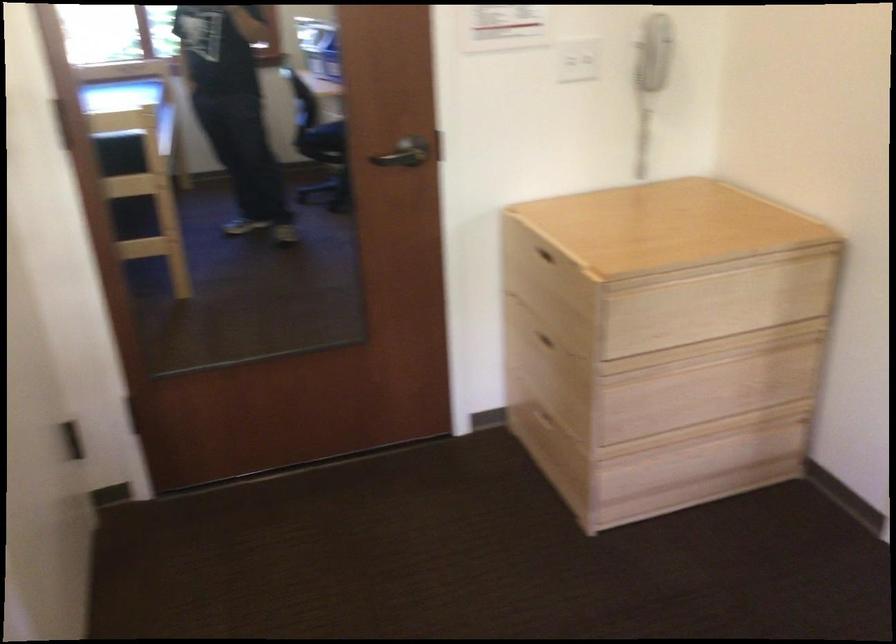
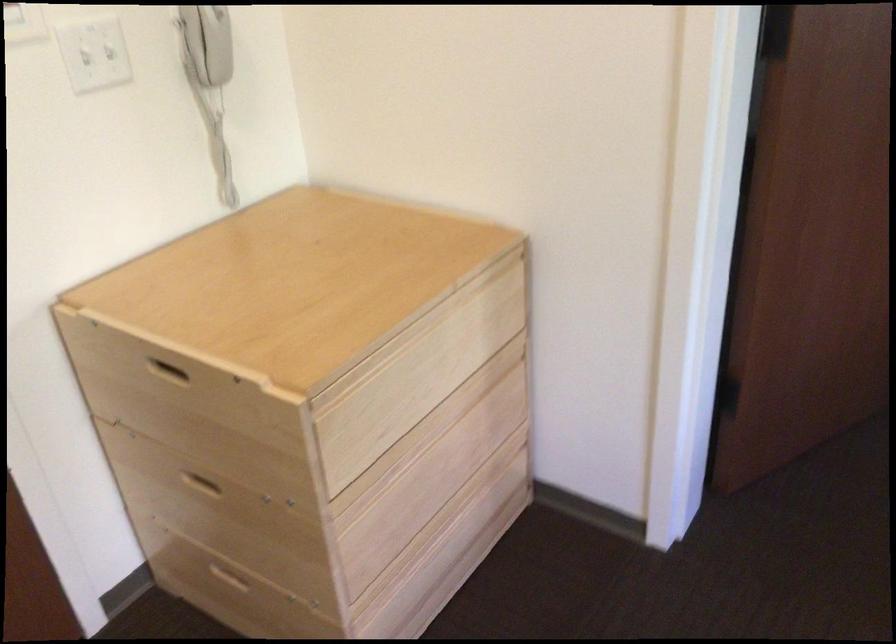
Question: The camera is either moving clockwise (left) or counter-clockwise (right) around the object. The first image is from the beginning of the video and the second image is from the end. Is the camera moving left or right when shooting the video?

Choices:
 (A) Left
 (B) Right

Answer: (A)